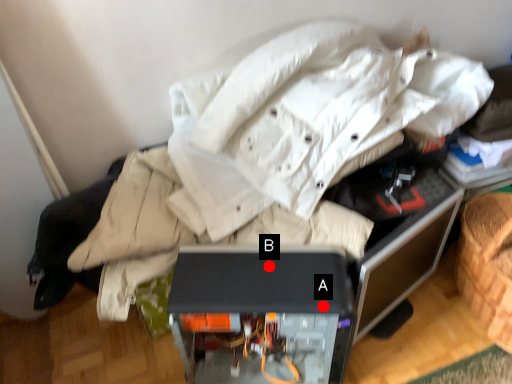
Question: Two points are circled on the image, labeled by A and B beside each circle. Which point is farther to the camera?

Choices:
 (A) A is further
 (B) B is further

Answer: (B)